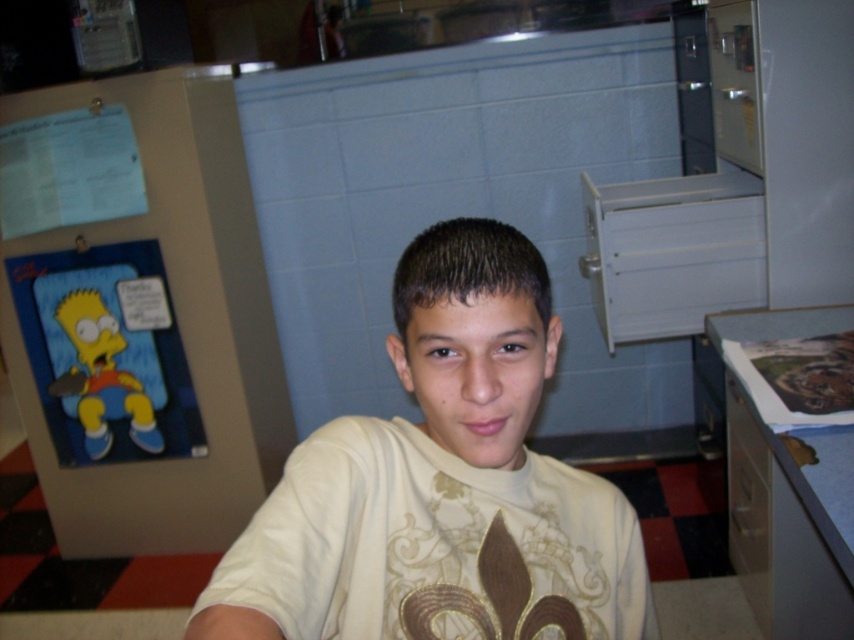
You are taking a photo of two points in the scene. The first point is at coordinate point (180,508) and the second is at point (326,572). Which point is closer to your camera?

Point (180,508) is further to the camera than point (326,572), so the second point is closer to the camera.

You are an interior designer assessing the space. Considering the blue cardboard poster at left and the white matte shirt at center, which object would require more wall space if you were to hang them both?

The blue cardboard poster at left is larger in size than the white matte shirt at center, so it would require more wall space.